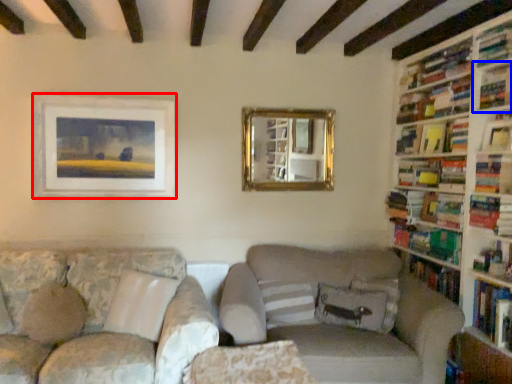
Question: Which point is further to the camera, picture frame (highlighted by a red box) or shelf (highlighted by a blue box)?

Choices:
 (A) picture frame
 (B) shelf

Answer: (A)